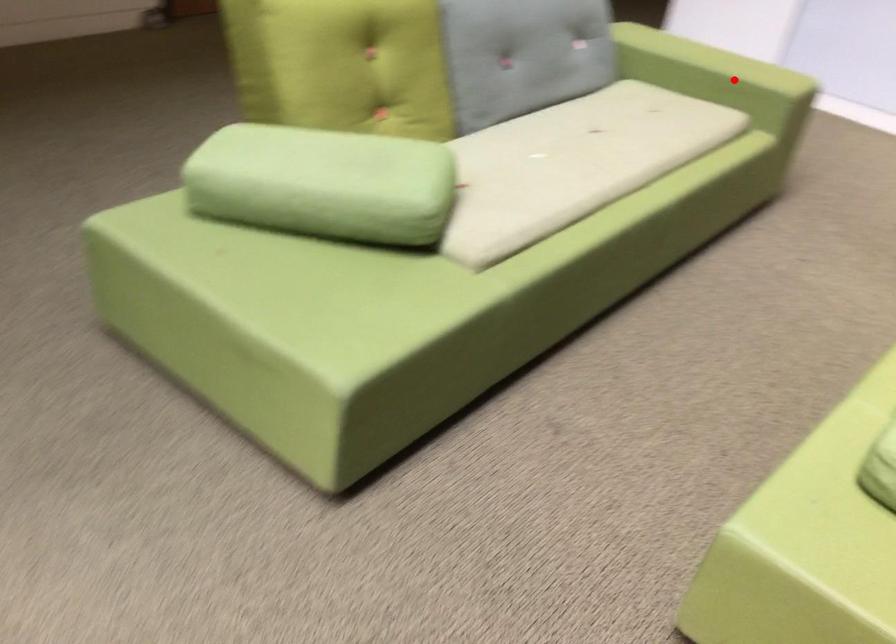
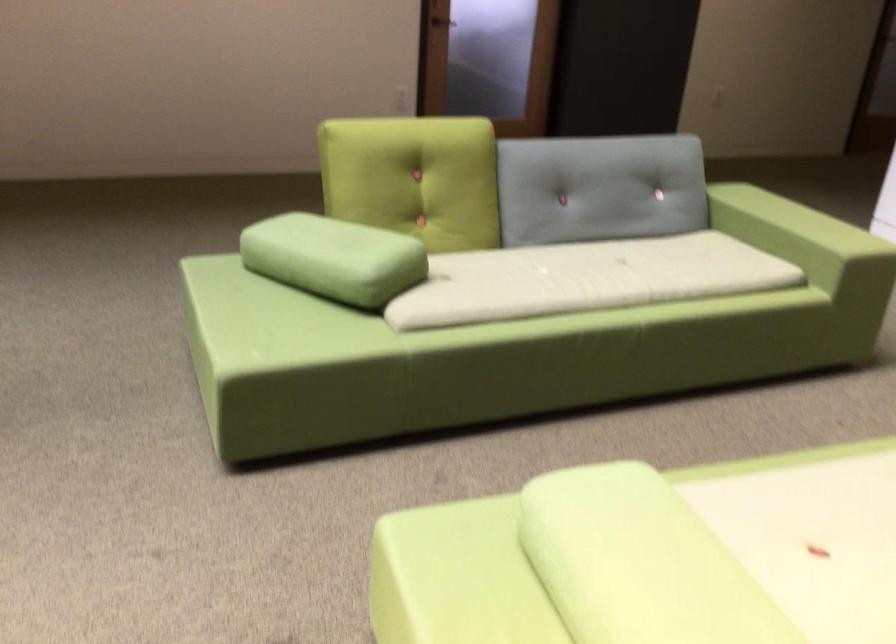
Question: I am providing you with two images of the same scene from different viewpoints. A red point is marked on the first image. At the location where the point appears in image 1, is it still visible in image 2?

Choices:
 (A) Yes
 (B) No

Answer: (A)